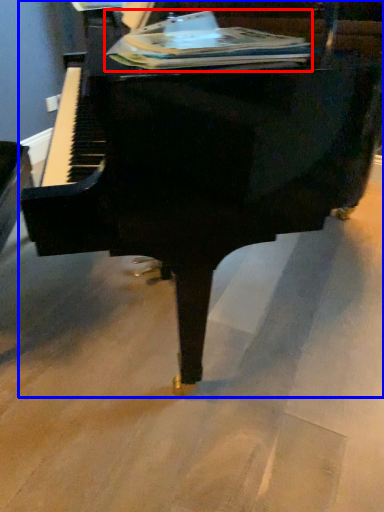
Question: Which object is further to the camera taking this photo, paperback book (highlighted by a red box) or piano (highlighted by a blue box)?

Choices:
 (A) paperback book
 (B) piano

Answer: (A)